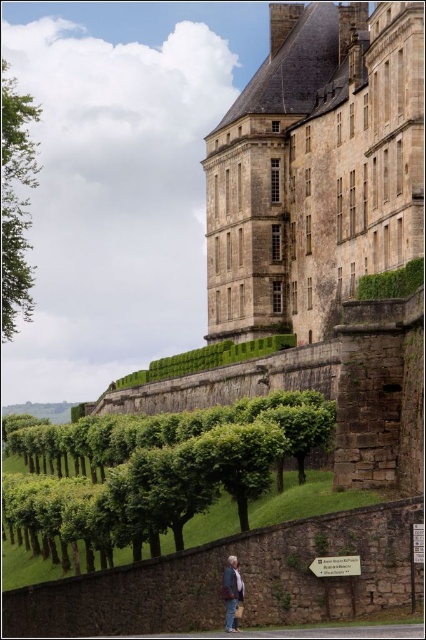
Question: Which point is closer to the camera?

Choices:
 (A) (256, 497)
 (B) (233, 582)
 (C) (391, 288)

Answer: (B)

Question: Where is brown stone castle at center located in relation to green leafy tree at left in the image?

Choices:
 (A) left
 (B) right

Answer: (B)

Question: From the image, what is the correct spatial relationship of brown stone castle at center in relation to brown stone castle at upper center?

Choices:
 (A) left
 (B) right

Answer: (A)

Question: Does brown stone castle at upper center appear on the left side of brown leather jacket at lower center?

Choices:
 (A) no
 (B) yes

Answer: (A)

Question: Which of the following is the closest to the observer?

Choices:
 (A) (230, 627)
 (B) (172, 520)
 (C) (290, 196)
 (D) (379, 298)

Answer: (A)

Question: Among these points, which one is farthest from the camera?

Choices:
 (A) (347, 118)
 (B) (227, 611)
 (C) (374, 273)

Answer: (A)